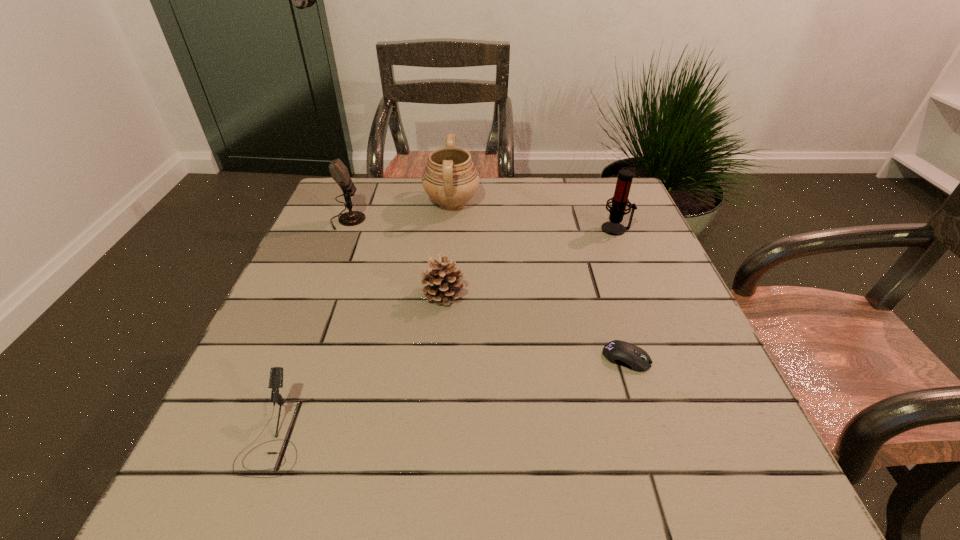
The image size is (960, 540). Find the location of `free space at the left edge`. free space at the left edge is located at coordinates (302, 265).

Where is `free space at the right edge of the desktop`? free space at the right edge of the desktop is located at coordinates (592, 237).

Where is `vacant region at the far left corner of the desktop`? Image resolution: width=960 pixels, height=540 pixels. vacant region at the far left corner of the desktop is located at coordinates (373, 191).

Locate an element on the screen. Image resolution: width=960 pixels, height=540 pixels. blank area at the near right corner is located at coordinates (779, 508).

At what (x,y) coordinates should I click in order to perform the action: click on unoccupied position between the computer equipment and the rightmost microphone. Please return your answer as a coordinate pair (x, y). The height and width of the screenshot is (540, 960). Looking at the image, I should click on (621, 294).

The height and width of the screenshot is (540, 960). Find the location of `vacant space in between the third nearest object and the rightmost microphone`. vacant space in between the third nearest object and the rightmost microphone is located at coordinates (530, 262).

This screenshot has width=960, height=540. Identify the location of unoccupied position between the shortest microphone and the fourth farthest object. (360, 364).

The image size is (960, 540). Find the location of `vacant space that's between the third nearest object and the computer equipment`. vacant space that's between the third nearest object and the computer equipment is located at coordinates (535, 326).

You are a GUI agent. You are given a task and a screenshot of the screen. Output one action in this format:
    pyautogui.click(x=<x>, y=<y>)
    Task: Click on the vacant area that lies between the rightmost microphone and the pinecone
    The width and height of the screenshot is (960, 540).
    Given the screenshot: What is the action you would take?
    pyautogui.click(x=530, y=262)

In order to click on vacant space that's between the urn and the nearest object in this screenshot , I will do `click(364, 319)`.